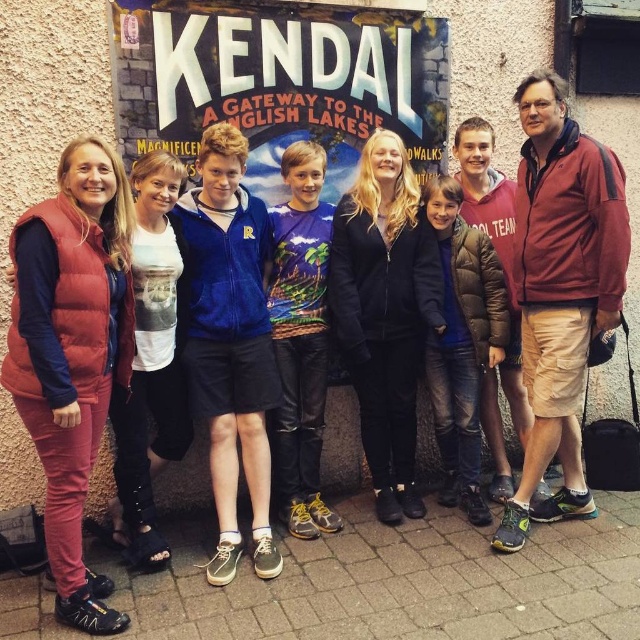
You are standing in front of the matte signboard at center with a camera that has a maximum focus range of 3 meters. Can you take a clear photo of the signboard without moving closer?

The matte signboard at center is 3.36 meters away from viewer. Since the camera can only focus up to 3 meters, it cannot capture the signboard clearly without moving closer.